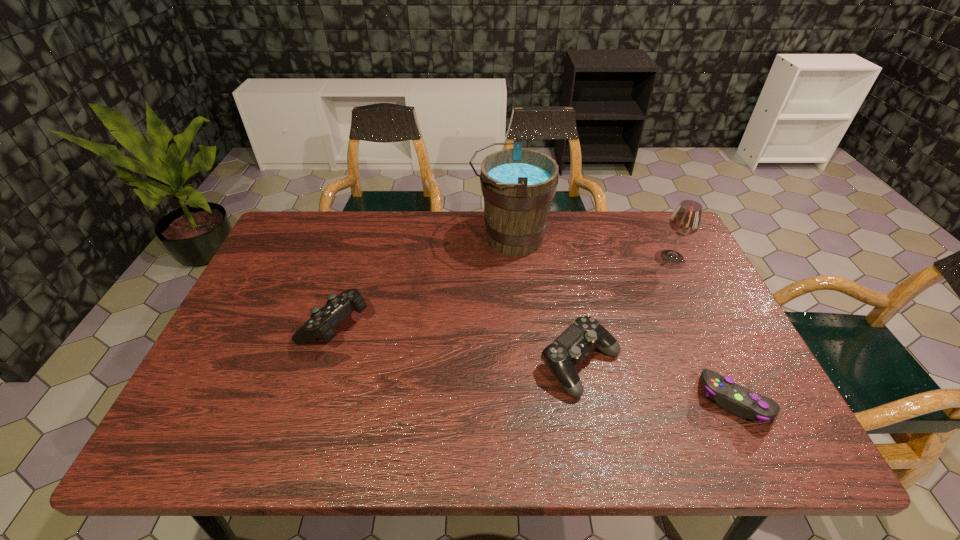
Identify the location of vacant area at the far edge of the desktop. (432, 235).

Locate an element on the screen. Image resolution: width=960 pixels, height=540 pixels. blank space at the near edge of the desktop is located at coordinates (373, 453).

Where is `vacant space at the left edge`? The image size is (960, 540). vacant space at the left edge is located at coordinates (278, 330).

In the image, there is a desktop. Find the location of `vacant area at the right edge`. vacant area at the right edge is located at coordinates (703, 284).

In the image, there is a desktop. Where is `blank space at the far right corner`? The height and width of the screenshot is (540, 960). blank space at the far right corner is located at coordinates (658, 224).

At what (x,y) coordinates should I click in order to perform the action: click on blank region between the tallest object and the second control from left to right. Please return your answer as a coordinate pair (x, y). Image resolution: width=960 pixels, height=540 pixels. Looking at the image, I should click on (545, 301).

Where is `vacant area that lies between the rightmost control and the second control from left to right`? The image size is (960, 540). vacant area that lies between the rightmost control and the second control from left to right is located at coordinates (658, 382).

The image size is (960, 540). I want to click on free space that is in between the tallest object and the shortest control, so click(623, 319).

Where is `free space between the wine bucket and the second control from right to left`? free space between the wine bucket and the second control from right to left is located at coordinates (545, 301).

I want to click on vacant area that lies between the leftmost control and the second control from right to left, so click(x=458, y=345).